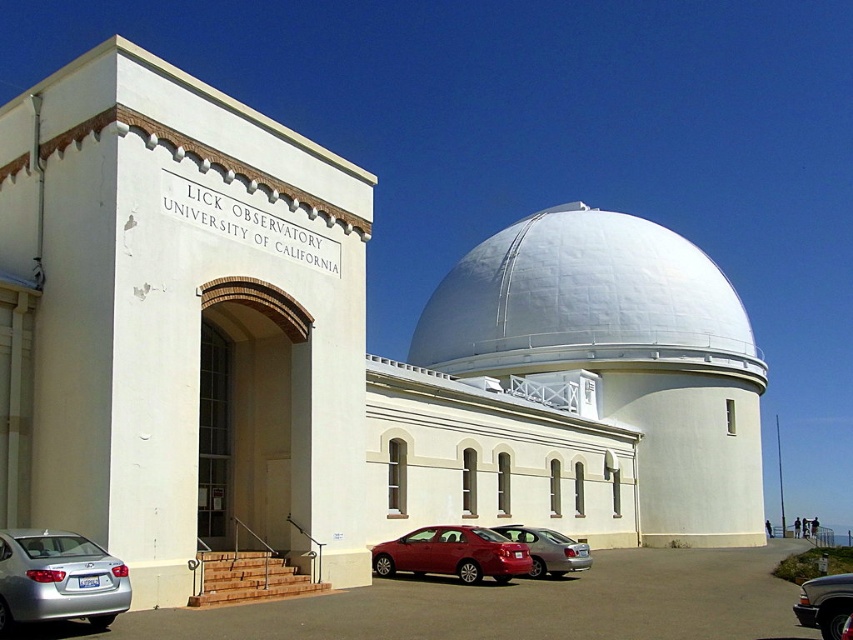
Is silver metallic sedan at lower left positioned at the back of shiny red sedan at center?

That is False.

Can you confirm if silver metallic sedan at lower left is taller than shiny red sedan at center?

Yes, silver metallic sedan at lower left is taller than shiny red sedan at center.

Is point (20, 611) closer to viewer compared to point (410, 540)?

Yes, point (20, 611) is closer to viewer.

Locate an element on the screen. This screenshot has height=640, width=853. silver metallic sedan at lower left is located at coordinates (57, 579).

Is point (349, 604) closer to camera compared to point (432, 566)?

Yes, it is in front of point (432, 566).

Who is taller, silver metallic car at lower left or shiny red sedan at center?

silver metallic car at lower left is taller.

Is point (654, 588) positioned after point (403, 547)?

No, it is not.

Locate an element on the screen. The height and width of the screenshot is (640, 853). silver metallic car at lower left is located at coordinates (511, 605).

Find the location of a particular element. The width and height of the screenshot is (853, 640). white smooth dome at center is located at coordinates (583, 300).

Which is behind, point (517, 364) or point (62, 554)?

The point (517, 364) is behind.

At what (x,y) coordinates should I click in order to perform the action: click on white smooth dome at center. Please return your answer as a coordinate pair (x, y). Looking at the image, I should click on (583, 300).